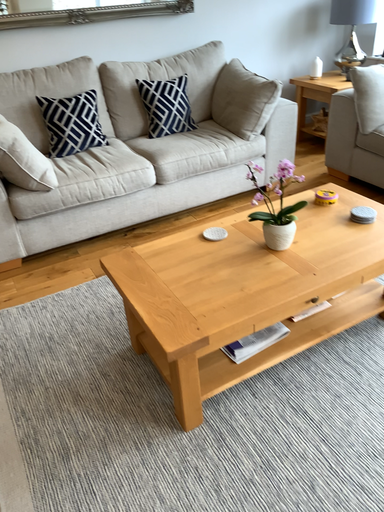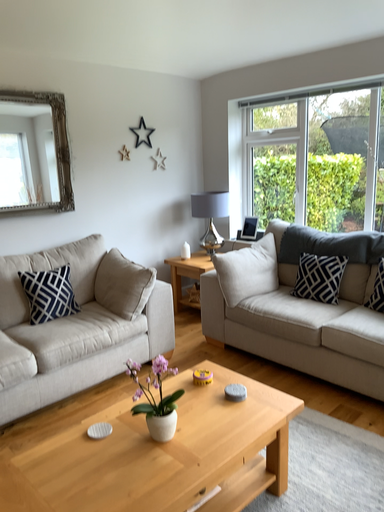
Question: How did the camera likely rotate when shooting the video?

Choices:
 (A) rotated upward
 (B) rotated downward

Answer: (A)